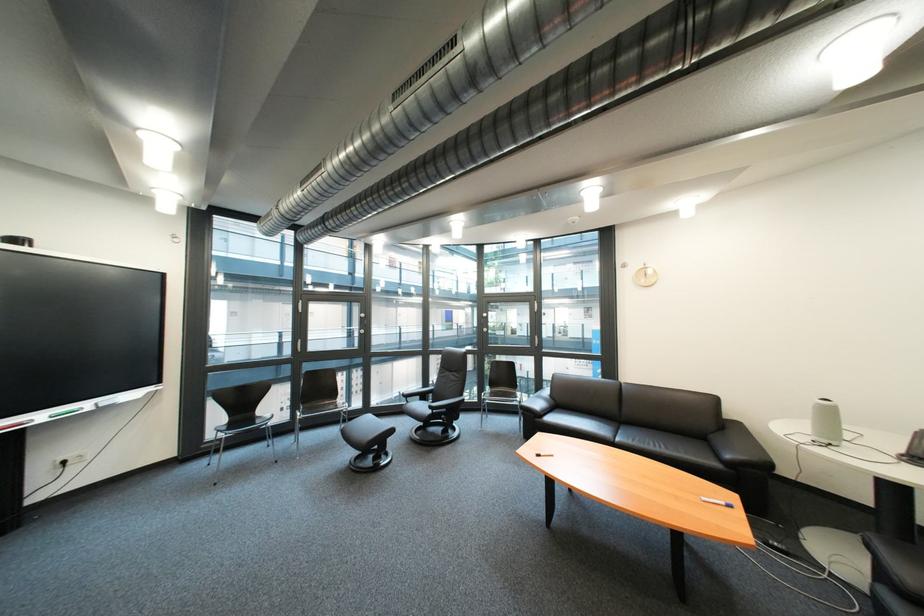
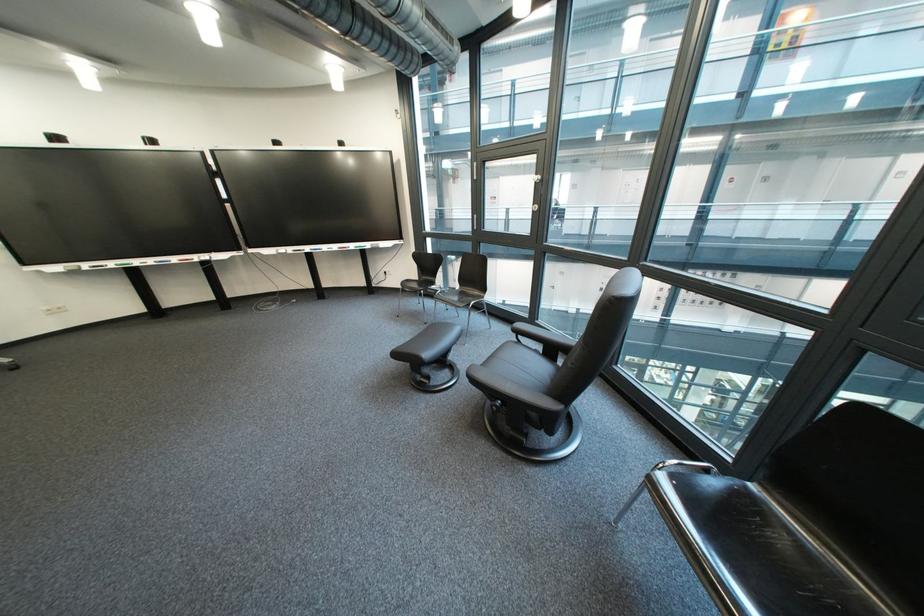
Where in the second image is the point corresponding to (x=246, y=426) from the first image?

(435, 284)